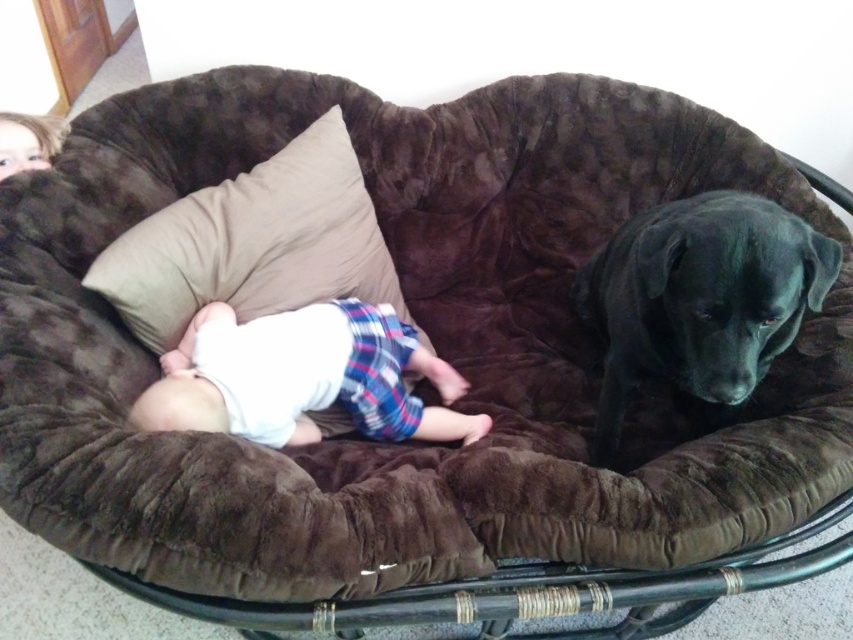
Can you confirm if beige fabric pillow at center is positioned to the left of white soft cloth at center?

Yes, beige fabric pillow at center is to the left of white soft cloth at center.

Measure the distance between point (x=134, y=244) and camera.

A distance of 4.42 feet exists between point (x=134, y=244) and camera.

The width and height of the screenshot is (853, 640). Identify the location of beige fabric pillow at center. (254, 243).

Can you confirm if black velvet dog at upper right is wider than beige fabric pillow at center?

Incorrect, black velvet dog at upper right's width does not surpass beige fabric pillow at center's.

Which is above, black velvet dog at upper right or beige fabric pillow at center?

beige fabric pillow at center

This screenshot has height=640, width=853. I want to click on black velvet dog at upper right, so click(698, 301).

Between black velvet dog at upper right and white soft cloth at center, which one appears on the left side from the viewer's perspective?

Answer: white soft cloth at center

Between black velvet dog at upper right and white soft cloth at center, which one is positioned higher?

black velvet dog at upper right is higher up.

Describe the element at coordinates (698, 301) in the screenshot. Image resolution: width=853 pixels, height=640 pixels. I see `black velvet dog at upper right` at that location.

Find the location of a particular element. black velvet dog at upper right is located at coordinates (698, 301).